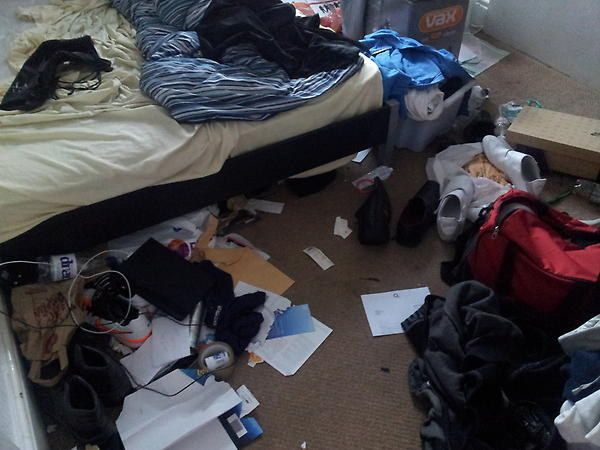
This screenshot has width=600, height=450. Identify the location of empty bottle. (65, 265).